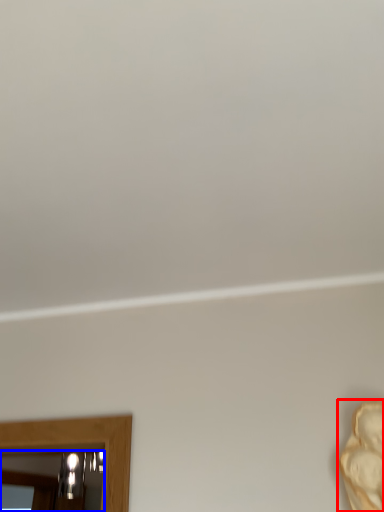
Question: Which point is further to the camera, person (highlighted by a red box) or mirror (highlighted by a blue box)?

Choices:
 (A) person
 (B) mirror

Answer: (B)